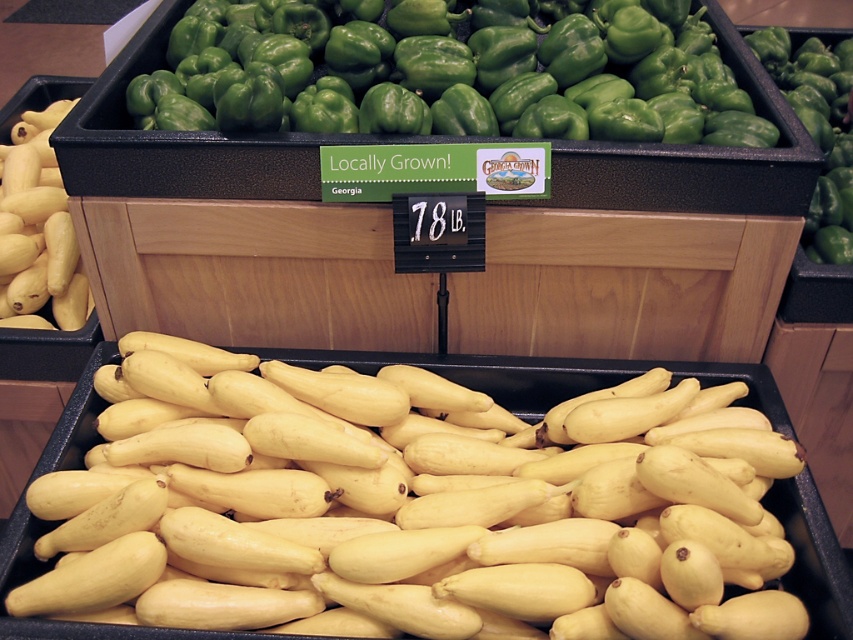
Question: Can you confirm if yellow matte squash at center is thinner than green glossy bell pepper at upper center?

Choices:
 (A) yes
 (B) no

Answer: (A)

Question: Which object is positioned closest to the yellow matte squash at center?

Choices:
 (A) yellow matte squash at left
 (B) green glossy bell pepper at upper center

Answer: (B)

Question: Does yellow matte squash at center have a lesser width compared to yellow matte squash at left?

Choices:
 (A) no
 (B) yes

Answer: (A)

Question: Which of the following is the farthest from the observer?

Choices:
 (A) (444, 68)
 (B) (415, 444)
 (C) (39, 304)

Answer: (C)

Question: Which of the following is the farthest from the observer?

Choices:
 (A) green glossy bell pepper at upper center
 (B) yellow matte squash at center

Answer: (A)

Question: Is the position of yellow matte squash at center more distant than that of yellow matte squash at left?

Choices:
 (A) no
 (B) yes

Answer: (A)